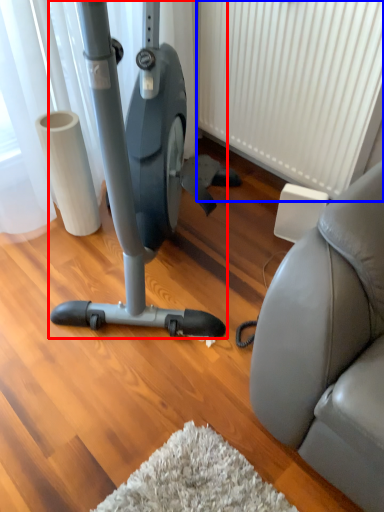
Question: Which object appears farthest to the camera in this image, stationary bicycle (highlighted by a red box) or radiator (highlighted by a blue box)?

Choices:
 (A) stationary bicycle
 (B) radiator

Answer: (B)